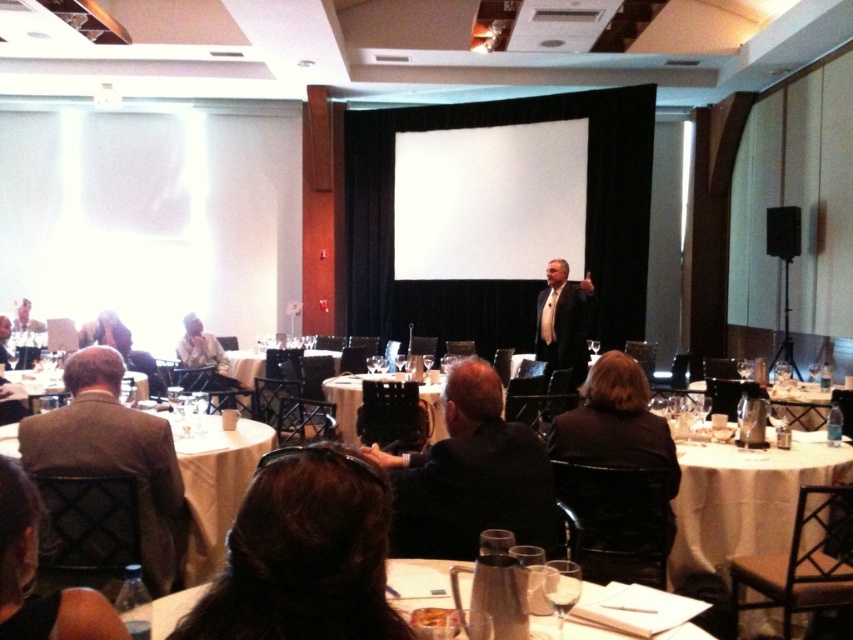
Does white tablecloth at lower left have a greater width compared to white glossy table at center?

Yes.

Is point (61, 392) closer to camera compared to point (251, 378)?

Yes, point (61, 392) is closer to viewer.

The width and height of the screenshot is (853, 640). In order to click on white tablecloth at lower left in this screenshot , I will do point(35,381).

Describe the element at coordinates (303, 554) in the screenshot. Image resolution: width=853 pixels, height=640 pixels. I see `brown hair at center` at that location.

Which is in front, point (357, 547) or point (552, 602)?

Point (357, 547)

In the scene shown: Who is more distant from viewer, (270, 554) or (561, 632)?

Positioned behind is point (561, 632).

This screenshot has height=640, width=853. In order to click on brown hair at center in this screenshot , I will do `click(303, 554)`.

Between white matte projection screen at center and white glossy table at center, which one has more height?

white matte projection screen at center is taller.

Who is positioned more to the right, white matte projection screen at center or white glossy table at center?

white matte projection screen at center

The height and width of the screenshot is (640, 853). Find the location of `white matte projection screen at center`. white matte projection screen at center is located at coordinates (489, 200).